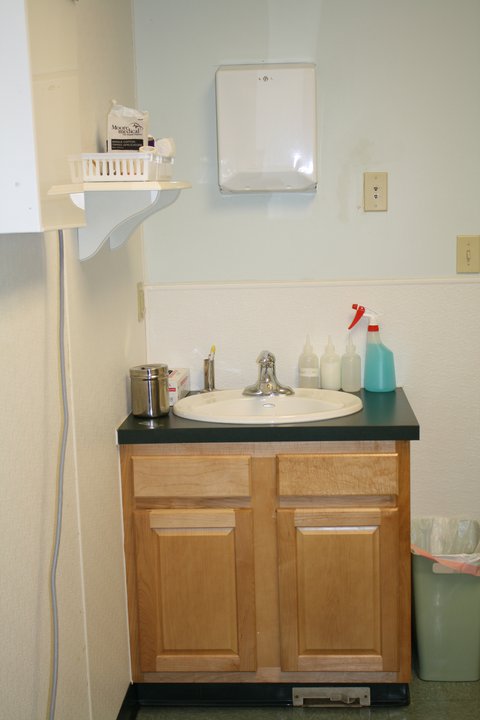
In order to click on light in this screenshot , I will do `click(473, 243)`.